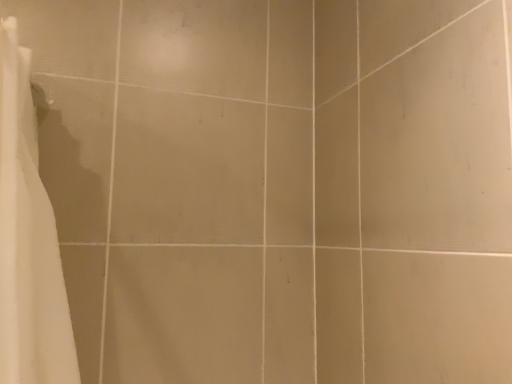
What do you see at coordinates (28, 239) in the screenshot?
I see `white fabric curtain at left` at bounding box center [28, 239].

Where is `white fabric curtain at left`? white fabric curtain at left is located at coordinates (28, 239).

You are a GUI agent. You are given a task and a screenshot of the screen. Output one action in this format:
    pyautogui.click(x=<x>, y=<y>)
    Task: Click on the white fabric curtain at left
    Image resolution: width=512 pixels, height=384 pixels.
    Given the screenshot: What is the action you would take?
    pyautogui.click(x=28, y=239)